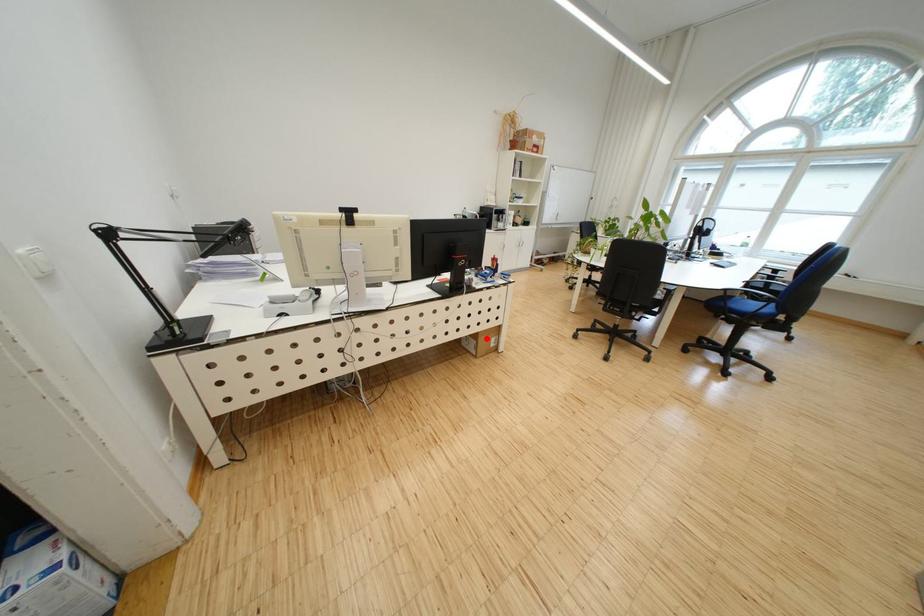
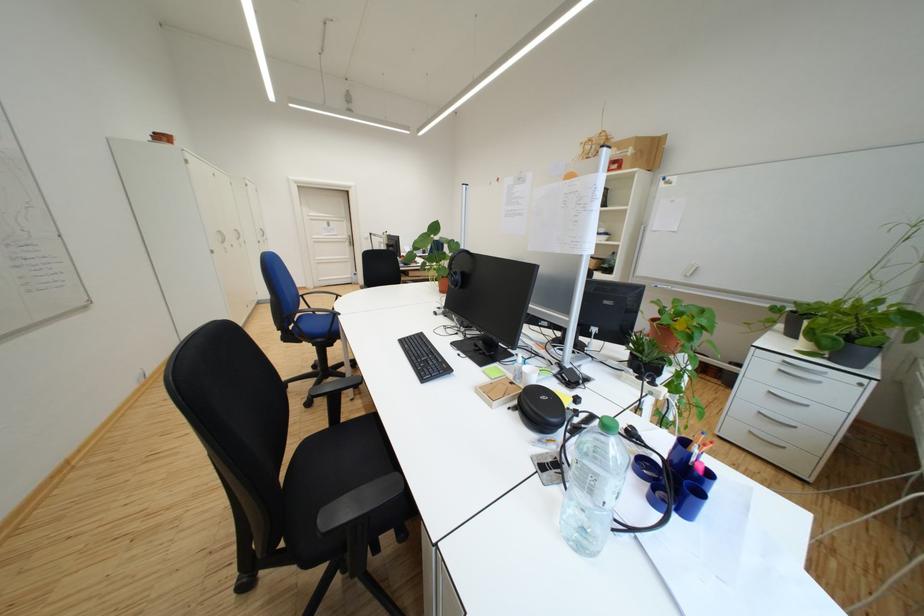
Question: I am providing you with two images of the same scene from different viewpoints. A red point is marked on the first image. At the location where the point appears in image 1, is it still visible in image 2?

Choices:
 (A) Yes
 (B) No

Answer: (B)